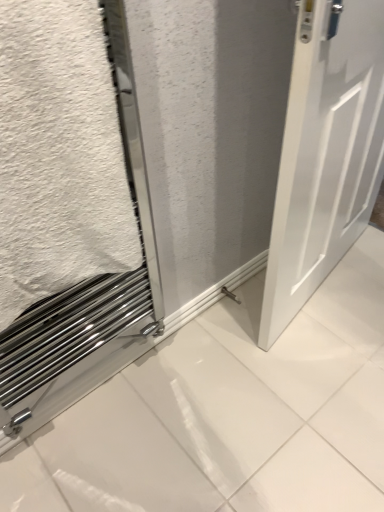
Question: Could you tell me if white matte door at right is turned towards white matte towel at lower left?

Choices:
 (A) yes
 (B) no

Answer: (B)

Question: From the image's perspective, does white matte door at right appear higher than white matte towel at lower left?

Choices:
 (A) yes
 (B) no

Answer: (B)

Question: Considering the relative sizes of white matte door at right and white matte towel at lower left in the image provided, is white matte door at right thinner than white matte towel at lower left?

Choices:
 (A) no
 (B) yes

Answer: (B)

Question: Does white matte door at right have a greater width compared to white matte towel at lower left?

Choices:
 (A) no
 (B) yes

Answer: (A)

Question: Does white matte door at right touch white matte towel at lower left?

Choices:
 (A) no
 (B) yes

Answer: (A)

Question: Is white matte towel at lower left inside white matte door at right?

Choices:
 (A) yes
 (B) no

Answer: (B)

Question: Can you confirm if white matte towel at lower left is smaller than white matte door at right?

Choices:
 (A) no
 (B) yes

Answer: (B)

Question: From a real-world perspective, is white matte towel at lower left physically above white matte door at right?

Choices:
 (A) no
 (B) yes

Answer: (B)

Question: Can you confirm if white matte towel at lower left is bigger than white matte door at right?

Choices:
 (A) no
 (B) yes

Answer: (A)

Question: Is white matte towel at lower left facing away from white matte door at right?

Choices:
 (A) yes
 (B) no

Answer: (B)

Question: From a real-world perspective, is white matte towel at lower left positioned under white matte door at right based on gravity?

Choices:
 (A) yes
 (B) no

Answer: (B)

Question: From the image's perspective, would you say white matte towel at lower left is positioned over white matte door at right?

Choices:
 (A) yes
 (B) no

Answer: (A)

Question: Is white matte door at right wider or thinner than white matte towel at lower left?

Choices:
 (A) thin
 (B) wide

Answer: (A)